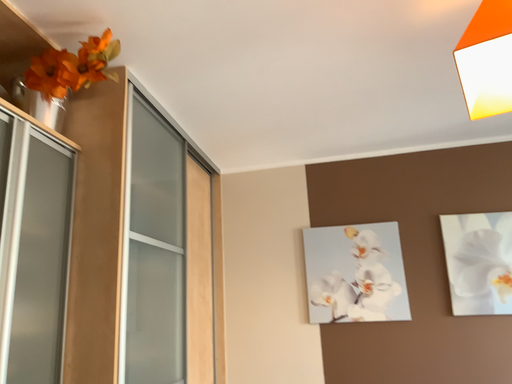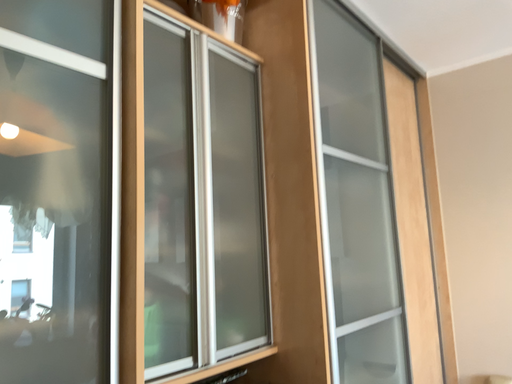
Question: Which way did the camera rotate in the video?

Choices:
 (A) rotated downward
 (B) rotated upward

Answer: (A)